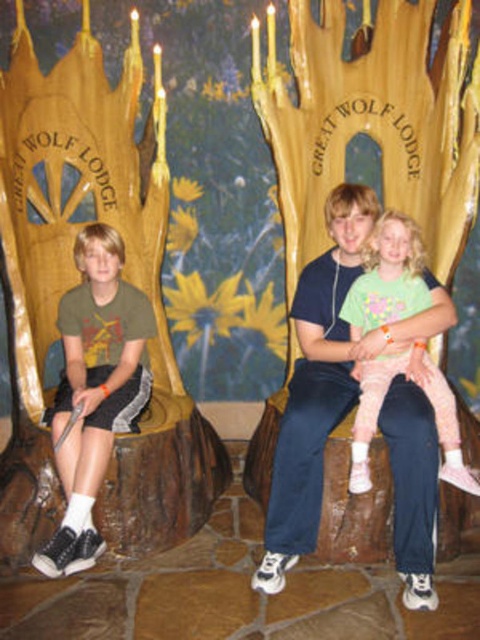
Who is shorter, light green cotton shirt at center or pink fabric pants at center?

Standing shorter between the two is pink fabric pants at center.

Locate an element on the screen. The width and height of the screenshot is (480, 640). light green cotton shirt at center is located at coordinates (316, 385).

Does matte green t-shirt at left appear over pink fabric pants at center?

Actually, matte green t-shirt at left is below pink fabric pants at center.

The image size is (480, 640). What do you see at coordinates (95, 388) in the screenshot?
I see `matte green t-shirt at left` at bounding box center [95, 388].

Where is `matte green t-shirt at left`? The width and height of the screenshot is (480, 640). matte green t-shirt at left is located at coordinates (95, 388).

The height and width of the screenshot is (640, 480). Find the location of `light green cotton shirt at center`. light green cotton shirt at center is located at coordinates (316, 385).

Is light green cotton shirt at center thinner than matte green t-shirt at left?

In fact, light green cotton shirt at center might be wider than matte green t-shirt at left.

What do you see at coordinates (316, 385) in the screenshot? This screenshot has height=640, width=480. I see `light green cotton shirt at center` at bounding box center [316, 385].

Image resolution: width=480 pixels, height=640 pixels. I want to click on light green cotton shirt at center, so click(x=316, y=385).